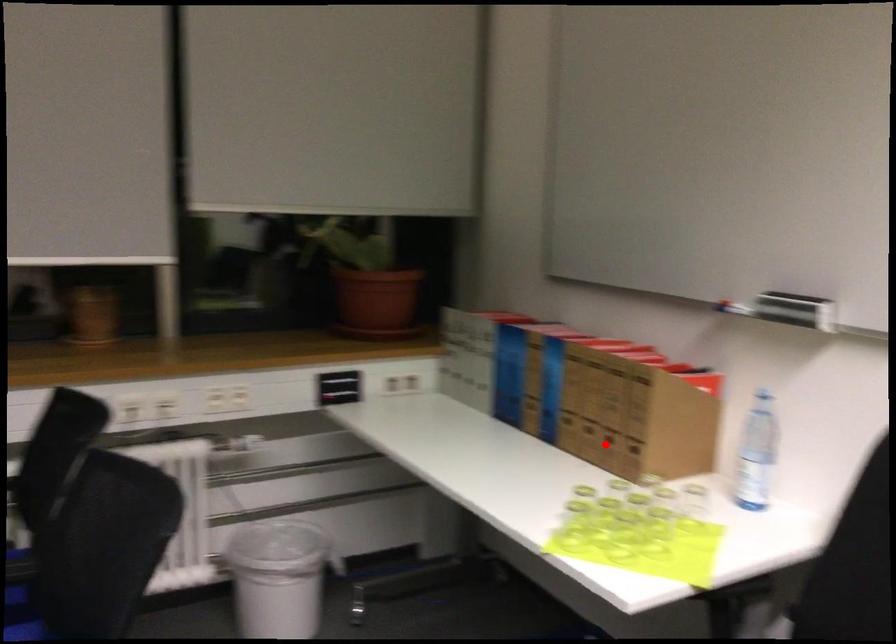
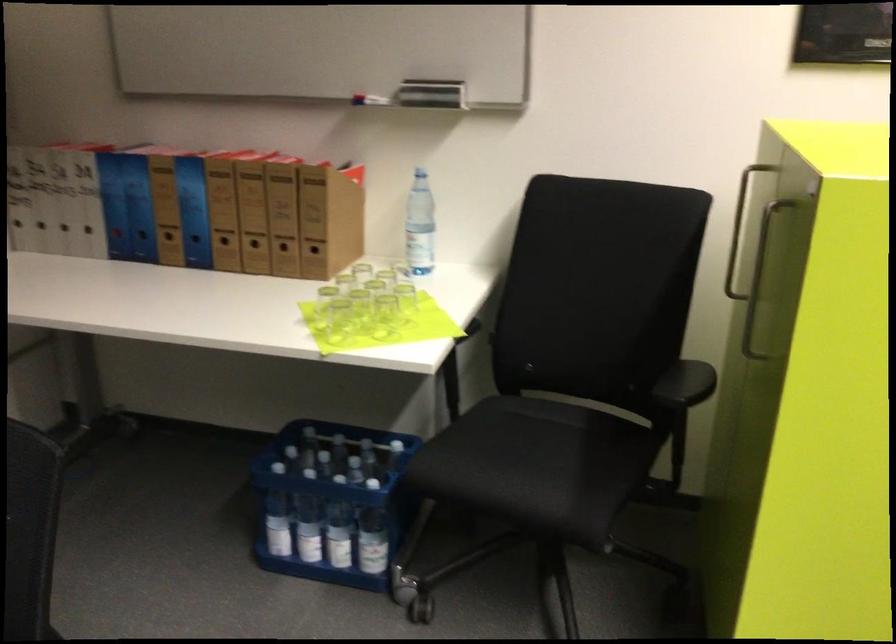
Find the pixel in the second image that matches the highlighted location in the first image.

(283, 252)